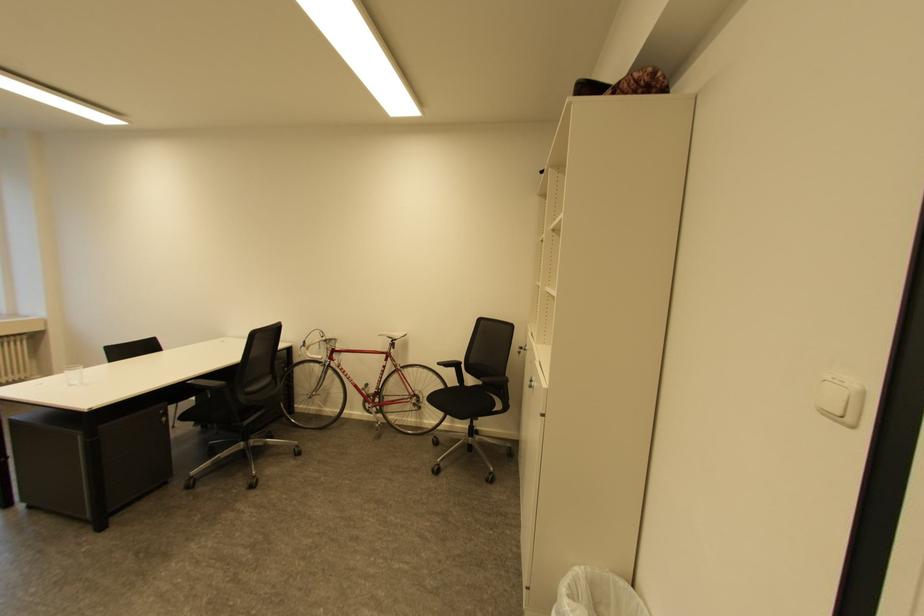
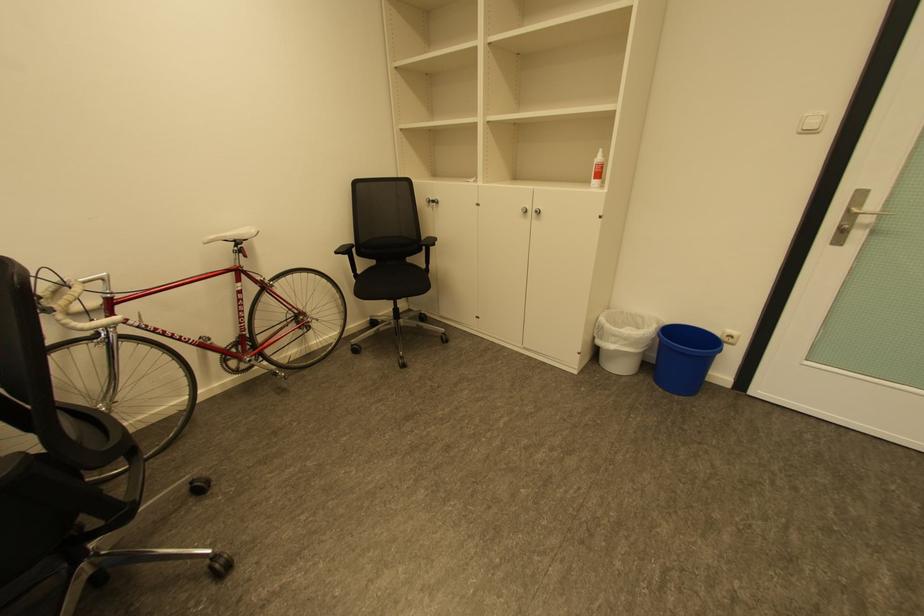
Find the pixel in the second image that matches (485,383) in the first image.

(380, 262)